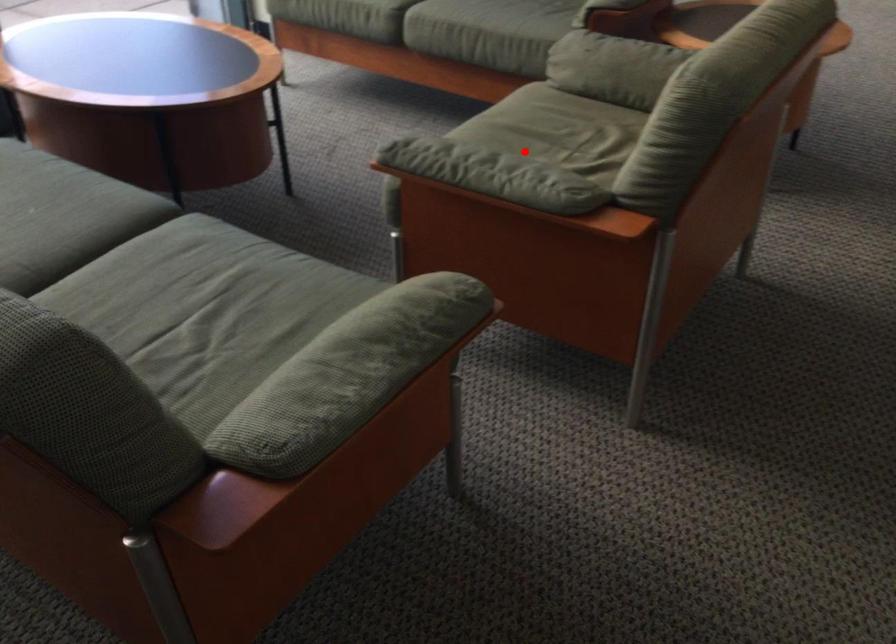
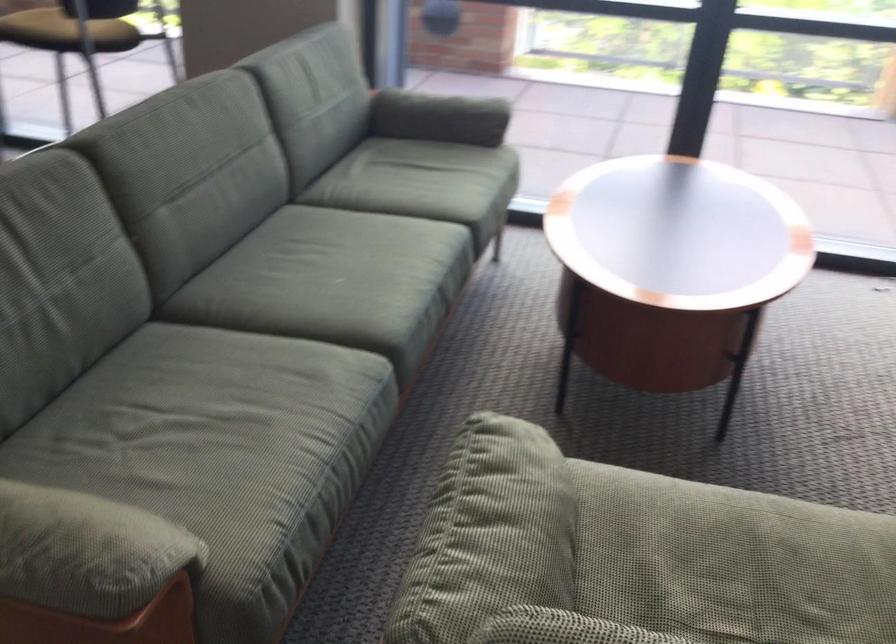
Where in the second image is the point corresponding to the highlighted location from the first image?

(702, 582)